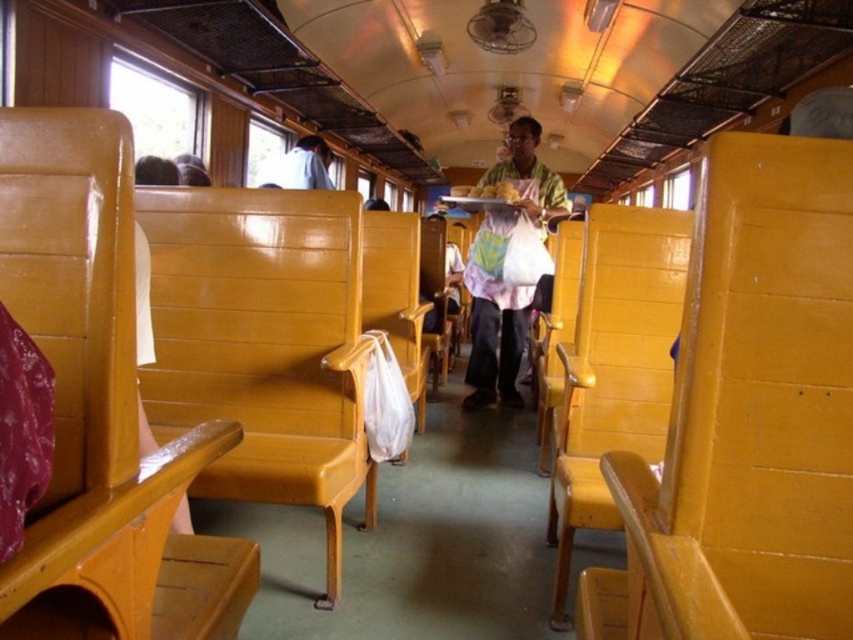
Is yellow wood chair at right positioned before white fabric bag at center?

That is True.

Does point (669, 387) lie in front of point (379, 305)?

Yes, point (669, 387) is in front of point (379, 305).

The width and height of the screenshot is (853, 640). Find the location of `yellow wood chair at right`. yellow wood chair at right is located at coordinates (613, 368).

In the scene shown: Can you confirm if matte green shirt at center is positioned above white fabric bag at center?

Indeed, matte green shirt at center is positioned over white fabric bag at center.

At what (x,y) coordinates should I click in order to perform the action: click on matte green shirt at center. Please return your answer as a coordinate pair (x, y). Looking at the image, I should click on (500, 273).

Where is `matte green shirt at center`? This screenshot has width=853, height=640. matte green shirt at center is located at coordinates (500, 273).

Find the location of `matte wood chair at center`. matte wood chair at center is located at coordinates (263, 344).

Is point (196, 481) behind point (384, 269)?

No, it is not.

Find the location of a particular element. Image resolution: width=853 pixels, height=640 pixels. matte wood chair at center is located at coordinates (263, 344).